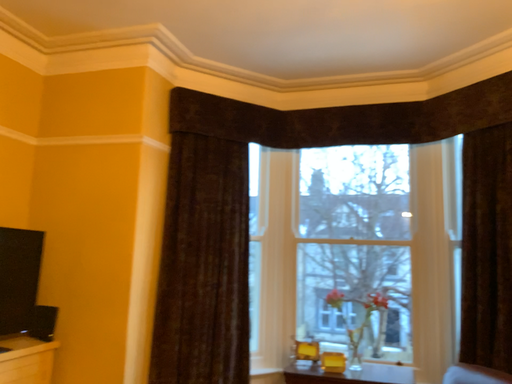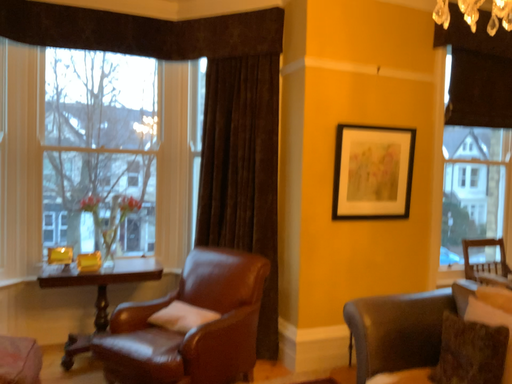
Question: Which way did the camera rotate in the video?

Choices:
 (A) rotated downward
 (B) rotated upward

Answer: (A)